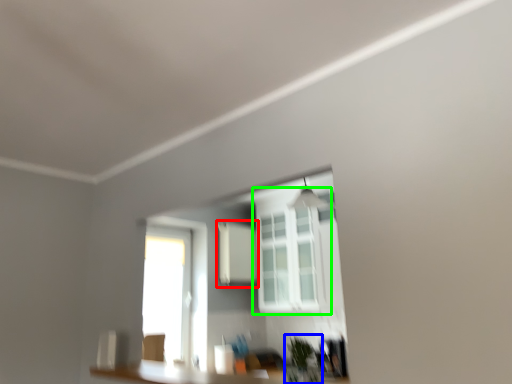
Question: Estimate the real-world distances between objects in this image. Which object is farther from medicine cabinet (highlighted by a red box), plant (highlighted by a blue box) or window (highlighted by a green box)?

Choices:
 (A) plant
 (B) window

Answer: (A)